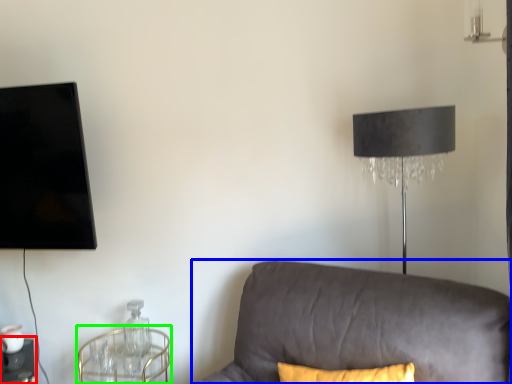
Question: Which is nearer to the table (highlighted by a red box)? studio couch (highlighted by a blue box) or round table (highlighted by a green box).

Choices:
 (A) studio couch
 (B) round table

Answer: (B)